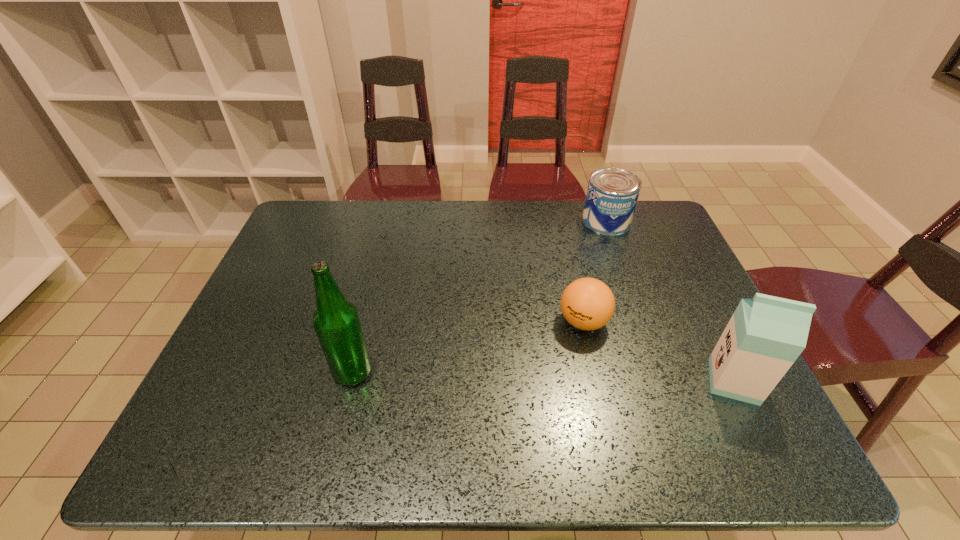
This screenshot has height=540, width=960. I want to click on the second closest object to the tallest object, so click(612, 194).

Locate an element on the screen. The image size is (960, 540). object that ranks as the closest to the beer bottle is located at coordinates (588, 304).

Identify the location of vacant space that satisfies the following two spatial constraints: 1. on the front side of the third object from right to left; 2. on the right side of the third shortest object. (597, 381).

Identify the location of free space that satisfies the following two spatial constraints: 1. on the front side of the second farthest object; 2. on the left side of the second tallest object. (597, 381).